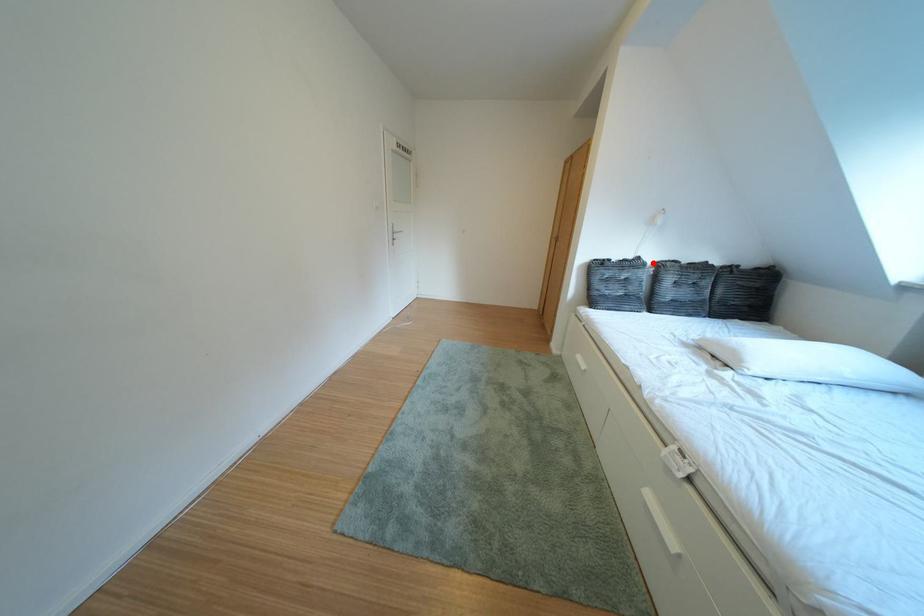
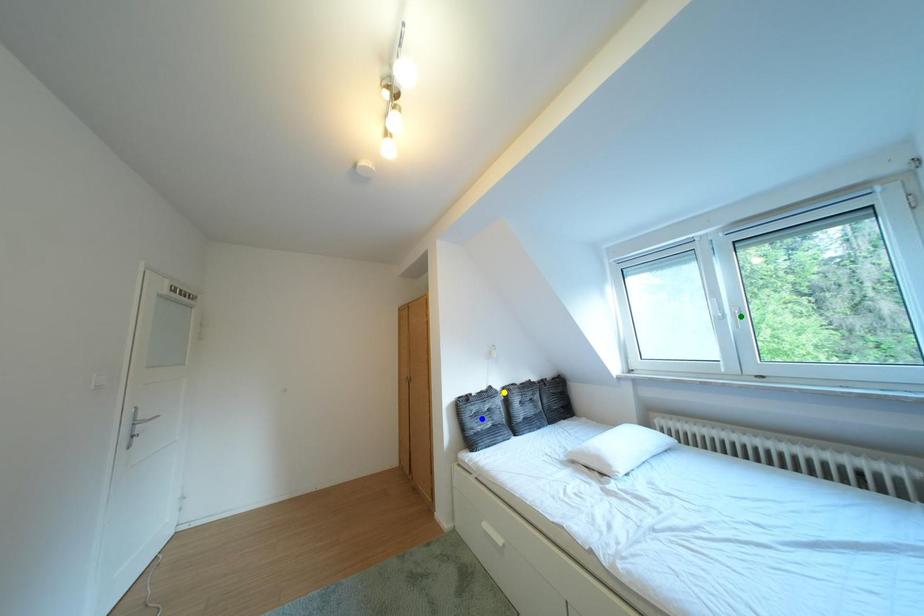
Question: I am providing you with two images of the same scene from different viewpoints. A red point is marked on the first image. You are given multiple points on the second image. Which point in image 2 is actually the same real-world point as the red point in image 1?

Choices:
 (A) blue point
 (B) yellow point
 (C) green point

Answer: (B)